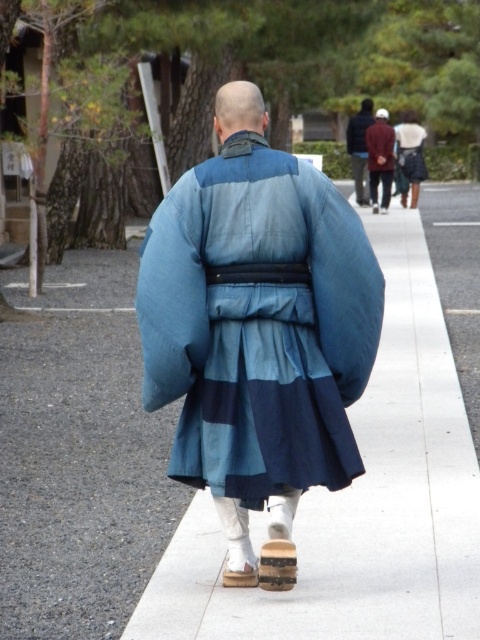
Question: Can you confirm if white concrete sidewalk at center is positioned below dark blue fabric bag at upper center?

Choices:
 (A) no
 (B) yes

Answer: (B)

Question: Is blue silk kimono at center thinner than dark blue fabric bag at upper center?

Choices:
 (A) no
 (B) yes

Answer: (B)

Question: Can you confirm if blue silk kimono at center is thinner than white concrete sidewalk at center?

Choices:
 (A) yes
 (B) no

Answer: (A)

Question: Which object appears closest to the camera in this image?

Choices:
 (A) dark blue fabric bag at upper center
 (B) white concrete sidewalk at center
 (C) blue silk kimono at center

Answer: (B)

Question: Which of the following is the closest to the observer?

Choices:
 (A) blue silk kimono at center
 (B) white concrete sidewalk at center
 (C) dark blue fabric bag at upper center

Answer: (B)

Question: Which object is closer to the camera taking this photo?

Choices:
 (A) dark blue fabric bag at upper center
 (B) white concrete sidewalk at center
 (C) blue silk kimono at center

Answer: (B)